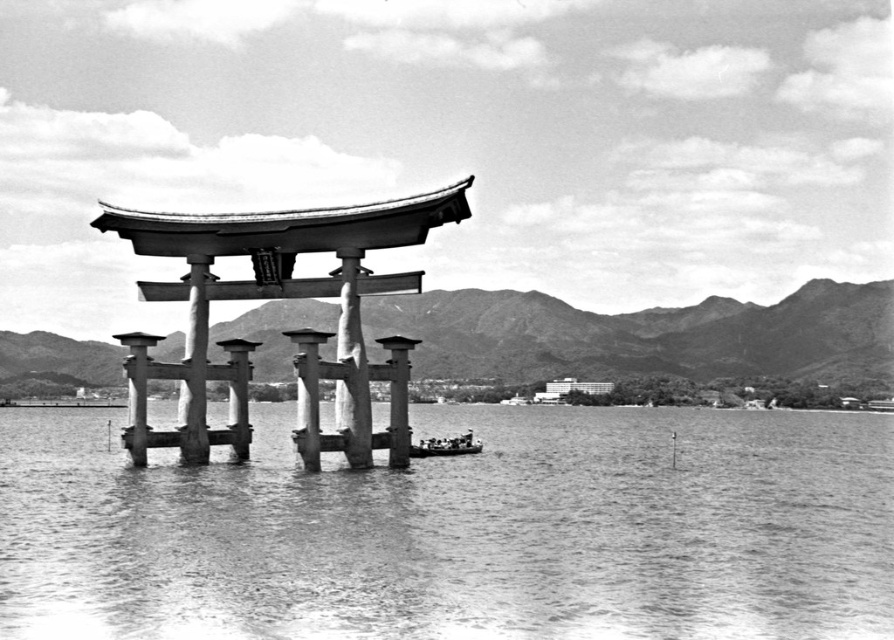
Can you confirm if smooth water at center is wider than smooth stone torii gate at center?

Yes.

Based on the photo, who is positioned more to the right, smooth water at center or smooth stone torii gate at center?

smooth water at center is more to the right.

This screenshot has height=640, width=894. Find the location of `smooth water at center`. smooth water at center is located at coordinates (460, 532).

Identify the location of smooth water at center. This screenshot has height=640, width=894. (460, 532).

Does smooth stone torii gate at center appear under smooth stone pillar at center?

Actually, smooth stone torii gate at center is above smooth stone pillar at center.

Which is more to the right, smooth stone torii gate at center or smooth stone pillar at center?

smooth stone torii gate at center is more to the right.

This screenshot has width=894, height=640. I want to click on smooth stone torii gate at center, so click(283, 332).

Identify the location of smooth stone pillar at center. The width and height of the screenshot is (894, 640). (239, 394).

Is smooth stone pillar at center smaller than smooth gray boat at center?

Correct, smooth stone pillar at center occupies less space than smooth gray boat at center.

I want to click on smooth stone pillar at center, so click(x=239, y=394).